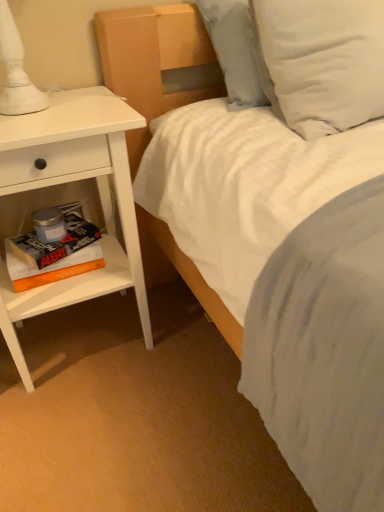
Measure the distance between point (39, 258) and camera.

Point (39, 258) is 3.57 feet from camera.

What is the approximate height of white matte nightstand at left?

28.02 inches.

This screenshot has width=384, height=512. In order to click on white textured pillow at upper right, which is counted as the first pillow, starting from the left in this screenshot , I will do `click(235, 50)`.

The image size is (384, 512). I want to click on the 1st pillow above the orange matte book at lower left, which ranks as the 2th paperback book in top-to-bottom order (from a real-world perspective), so click(x=324, y=61).

Is white soft pillow at upper right, acting as the second pillow starting from the left, aimed at orange matte book at lower left, which is counted as the 1th paperback book, starting from the bottom?

No, white soft pillow at upper right, acting as the second pillow starting from the left, does not turn towards orange matte book at lower left, which is counted as the 1th paperback book, starting from the bottom.

Which of these two, white soft pillow at upper right, acting as the second pillow starting from the left, or orange matte book at lower left, which is counted as the 1th paperback book, starting from the bottom, is thinner?

orange matte book at lower left, which is counted as the 1th paperback book, starting from the bottom, is thinner.

In order to click on the 2nd pillow above when counting from the hardcover book at left, which is counted as the second paperback book, starting from the bottom (from the image's perspective) in this screenshot , I will do `click(235, 50)`.

Would you say hardcover book at left, which is counted as the second paperback book, starting from the bottom, is a long distance from white textured pillow at upper right, which is counted as the first pillow, starting from the left?

No, hardcover book at left, which is counted as the second paperback book, starting from the bottom, is not far from white textured pillow at upper right, which is counted as the first pillow, starting from the left.

Is hardcover book at left, which is counted as the second paperback book, starting from the bottom, positioned with its back to white textured pillow at upper right, which is counted as the first pillow, starting from the left?

No, hardcover book at left, which is counted as the second paperback book, starting from the bottom, is not facing the opposite direction of white textured pillow at upper right, which is counted as the first pillow, starting from the left.

Which of these two, hardcover book at left, which is counted as the second paperback book, starting from the bottom, or white textured pillow at upper right, which is the 2th pillow in right-to-left order, is thinner?

hardcover book at left, which is counted as the second paperback book, starting from the bottom, is thinner.

Is white matte nightstand at left facing towards white textured pillow at upper right, which is counted as the first pillow, starting from the left?

No, white matte nightstand at left is not oriented towards white textured pillow at upper right, which is counted as the first pillow, starting from the left.

From their relative heights in the image, would you say white matte nightstand at left is taller or shorter than white textured pillow at upper right, which is the 2th pillow in right-to-left order?

In the image, white matte nightstand at left appears to be taller than white textured pillow at upper right, which is the 2th pillow in right-to-left order.

Between white matte nightstand at left and white textured pillow at upper right, which is counted as the first pillow, starting from the left, which one has larger size?

white matte nightstand at left.

Locate an element on the screen. This screenshot has width=384, height=512. nightstand located below the white textured pillow at upper right, which is the 2th pillow in right-to-left order (from the image's perspective) is located at coordinates (68, 182).

Is white textured pillow at upper right, which is counted as the first pillow, starting from the left, bigger than white matte nightstand at left?

No.

Is white textured pillow at upper right, which is counted as the first pillow, starting from the left, positioned behind white matte nightstand at left?

Yes, white textured pillow at upper right, which is counted as the first pillow, starting from the left, is behind white matte nightstand at left.

Can you confirm if white textured pillow at upper right, which is the 2th pillow in right-to-left order, is shorter than white matte nightstand at left?

Indeed, white textured pillow at upper right, which is the 2th pillow in right-to-left order, has a lesser height compared to white matte nightstand at left.

Is white matte nightstand at left far away from hardcover book at left, which is counted as the second paperback book, starting from the bottom?

They are positioned close to each other.

Is hardcover book at left, which is counted as the second paperback book, starting from the bottom, at the back of white matte nightstand at left?

That's right, white matte nightstand at left is facing away from hardcover book at left, which is counted as the second paperback book, starting from the bottom.

You are a GUI agent. You are given a task and a screenshot of the screen. Output one action in this format:
    pyautogui.click(x=<x>, y=<y>)
    Task: Click on the nightstand above the hardcover book at left, which is counted as the second paperback book, starting from the bottom (from a real-world perspective)
    
    Given the screenshot: What is the action you would take?
    pyautogui.click(x=68, y=182)

Is point (49, 131) less distant than point (84, 240)?

Yes, it is in front of point (84, 240).

Is white soft pillow at upper right, acting as the second pillow starting from the left, positioned far away from white textured pillow at upper right, which is the 2th pillow in right-to-left order?

No, white soft pillow at upper right, acting as the second pillow starting from the left, is not far away from white textured pillow at upper right, which is the 2th pillow in right-to-left order.

Is white soft pillow at upper right, arranged as the 1th pillow when viewed from the right, further to the viewer compared to white textured pillow at upper right, which is counted as the first pillow, starting from the left?

No, the depth of white soft pillow at upper right, arranged as the 1th pillow when viewed from the right, is less than that of white textured pillow at upper right, which is counted as the first pillow, starting from the left.

Is white soft pillow at upper right, arranged as the 1th pillow when viewed from the right, turned away from white textured pillow at upper right, which is the 2th pillow in right-to-left order?

Yes, white soft pillow at upper right, arranged as the 1th pillow when viewed from the right, is facing away from white textured pillow at upper right, which is the 2th pillow in right-to-left order.

From a real-world perspective, who is located higher, white soft pillow at upper right, acting as the second pillow starting from the left, or white textured pillow at upper right, which is counted as the first pillow, starting from the left?

white textured pillow at upper right, which is counted as the first pillow, starting from the left, is physically above.

From a real-world perspective, between orange matte book at lower left, which is counted as the 1th paperback book, starting from the bottom, and white textured pillow at upper right, which is counted as the first pillow, starting from the left, who is vertically higher?

white textured pillow at upper right, which is counted as the first pillow, starting from the left, from a real-world perspective.

Between point (83, 272) and point (244, 34), which one is positioned in front?

The point (244, 34) is in front.

Which object is wider, orange matte book at lower left, which ranks as the 2th paperback book in top-to-bottom order, or white textured pillow at upper right, which is counted as the first pillow, starting from the left?

With larger width is white textured pillow at upper right, which is counted as the first pillow, starting from the left.

Considering the relative positions of orange matte book at lower left, which ranks as the 2th paperback book in top-to-bottom order, and white textured pillow at upper right, which is the 2th pillow in right-to-left order, in the image provided, is orange matte book at lower left, which ranks as the 2th paperback book in top-to-bottom order, in front of white textured pillow at upper right, which is the 2th pillow in right-to-left order,?

No, it is behind white textured pillow at upper right, which is the 2th pillow in right-to-left order.

Which paperback book is the 2nd one when counting from the left side of the white soft pillow at upper right, arranged as the 1th pillow when viewed from the right? Please provide its 2D coordinates.

[(53, 267)]

From a real-world perspective, which pillow is the 2nd one above the hardcover book at left, which is the 1th paperback book in top-to-bottom order? Please provide its 2D coordinates.

[(235, 50)]

Looking at the image, which one is located further to white textured pillow at upper right, which is the 2th pillow in right-to-left order, white matte nightstand at left or hardcover book at left, which is counted as the second paperback book, starting from the bottom?

hardcover book at left, which is counted as the second paperback book, starting from the bottom, is positioned further to the anchor white textured pillow at upper right, which is the 2th pillow in right-to-left order.

From the image, which object appears to be nearer to white textured pillow at upper right, which is counted as the first pillow, starting from the left, hardcover book at left, which is the 1th paperback book in top-to-bottom order, or white soft pillow at upper right, acting as the second pillow starting from the left?

white soft pillow at upper right, acting as the second pillow starting from the left.

From the image, which object appears to be nearer to orange matte book at lower left, which ranks as the 2th paperback book in top-to-bottom order, white textured pillow at upper right, which is the 2th pillow in right-to-left order, or white matte nightstand at left?

white matte nightstand at left lies closer to orange matte book at lower left, which ranks as the 2th paperback book in top-to-bottom order, than the other object.

Estimate the real-world distances between objects in this image. Which object is further from orange matte book at lower left, which is counted as the 1th paperback book, starting from the bottom, white textured pillow at upper right, which is the 2th pillow in right-to-left order, or hardcover book at left, which is counted as the second paperback book, starting from the bottom?

The object further to orange matte book at lower left, which is counted as the 1th paperback book, starting from the bottom, is white textured pillow at upper right, which is the 2th pillow in right-to-left order.

Estimate the real-world distances between objects in this image. Which object is further from white matte nightstand at left, white soft pillow at upper right, arranged as the 1th pillow when viewed from the right, or white textured pillow at upper right, which is counted as the first pillow, starting from the left?

Among the two, white soft pillow at upper right, arranged as the 1th pillow when viewed from the right, is located further to white matte nightstand at left.

Estimate the real-world distances between objects in this image. Which object is further from orange matte book at lower left, which is counted as the 1th paperback book, starting from the bottom, white soft pillow at upper right, acting as the second pillow starting from the left, or white matte nightstand at left?

white soft pillow at upper right, acting as the second pillow starting from the left.

Looking at the image, which one is located closer to white matte nightstand at left, white textured pillow at upper right, which is counted as the first pillow, starting from the left, or orange matte book at lower left, which is counted as the 1th paperback book, starting from the bottom?

orange matte book at lower left, which is counted as the 1th paperback book, starting from the bottom, lies closer to white matte nightstand at left than the other object.

Estimate the real-world distances between objects in this image. Which object is further from hardcover book at left, which is the 1th paperback book in top-to-bottom order, white textured pillow at upper right, which is counted as the first pillow, starting from the left, or white soft pillow at upper right, arranged as the 1th pillow when viewed from the right?

Based on the image, white soft pillow at upper right, arranged as the 1th pillow when viewed from the right, appears to be further to hardcover book at left, which is the 1th paperback book in top-to-bottom order.

Locate an element on the screen. nightstand located between orange matte book at lower left, which is counted as the 1th paperback book, starting from the bottom, and white soft pillow at upper right, arranged as the 1th pillow when viewed from the right, in the left-right direction is located at coordinates (68, 182).

The width and height of the screenshot is (384, 512). In order to click on pillow between hardcover book at left, which is counted as the second paperback book, starting from the bottom, and white soft pillow at upper right, acting as the second pillow starting from the left in this screenshot , I will do pos(235,50).

You are a GUI agent. You are given a task and a screenshot of the screen. Output one action in this format:
    pyautogui.click(x=<x>, y=<y>)
    Task: Click on the nightstand between hardcover book at left, which is counted as the second paperback book, starting from the bottom, and white soft pillow at upper right, acting as the second pillow starting from the left, from left to right
    
    Given the screenshot: What is the action you would take?
    pyautogui.click(x=68, y=182)

Where is `paperback book located between orange matte book at lower left, which is counted as the 1th paperback book, starting from the bottom, and white soft pillow at upper right, arranged as the 1th pillow when viewed from the right, in the left-right direction`? paperback book located between orange matte book at lower left, which is counted as the 1th paperback book, starting from the bottom, and white soft pillow at upper right, arranged as the 1th pillow when viewed from the right, in the left-right direction is located at coordinates (56, 241).